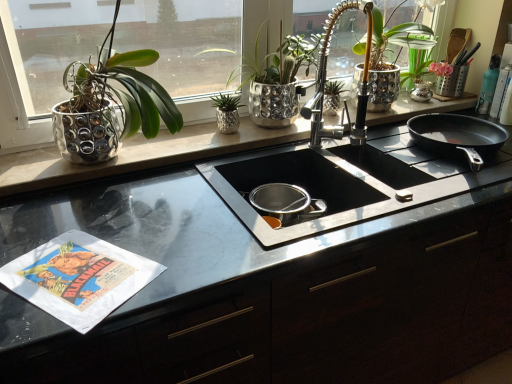
The width and height of the screenshot is (512, 384). I want to click on vacant space positioned to the left of green metallic plant at center, which is the 2th houseplant in left-to-right order, so tap(195, 136).